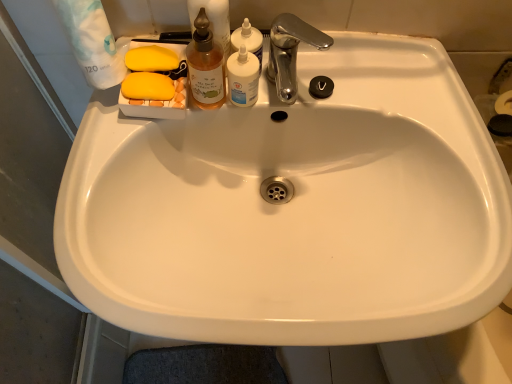
Question: From the image's perspective, is translucent glass bottle at upper center, which appears as the 1th cleaning product when viewed from the left, above or below translucent plastic bottle at upper center, the 1th cleaning product positioned from the right?

Choices:
 (A) above
 (B) below

Answer: (B)

Question: In terms of height, does translucent glass bottle at upper center, the 2th cleaning product positioned from the right, look taller or shorter compared to translucent plastic bottle at upper center, the 1th cleaning product positioned from the right?

Choices:
 (A) tall
 (B) short

Answer: (A)

Question: Considering the real-world distances, which object is farthest from the white opaque bottle at upper center?

Choices:
 (A) chrome metallic faucet at upper center
 (B) translucent plastic bottle at upper center, the second cleaning product from the left
 (C) translucent glass bottle at upper center, the 2th cleaning product positioned from the right

Answer: (A)

Question: Based on their relative distances, which object is nearer to the chrome metallic faucet at upper center?

Choices:
 (A) translucent plastic bottle at upper center, the 1th cleaning product positioned from the right
 (B) white opaque bottle at upper center
 (C) translucent glass bottle at upper center, which appears as the 1th cleaning product when viewed from the left

Answer: (A)